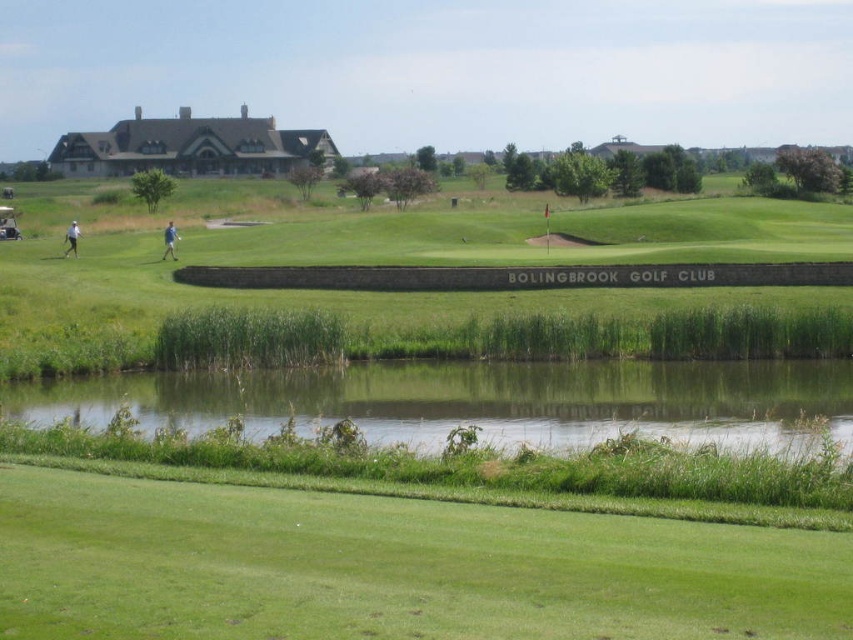
You are standing at the center of the golf course and see the point marked at coordinates (431, 324). What is the color of the area at that point?

The point marked at coordinates (431, 324) corresponds to green grass at upper center.

You are standing at the position of the camera observing the golf course. There are two points marked on the image, point [178,292] and point [71,243]. Which point is nearer to your current position?

Point [178,292] is closer to the camera than point [71,243], so the point [178,292] is nearer to your current position.